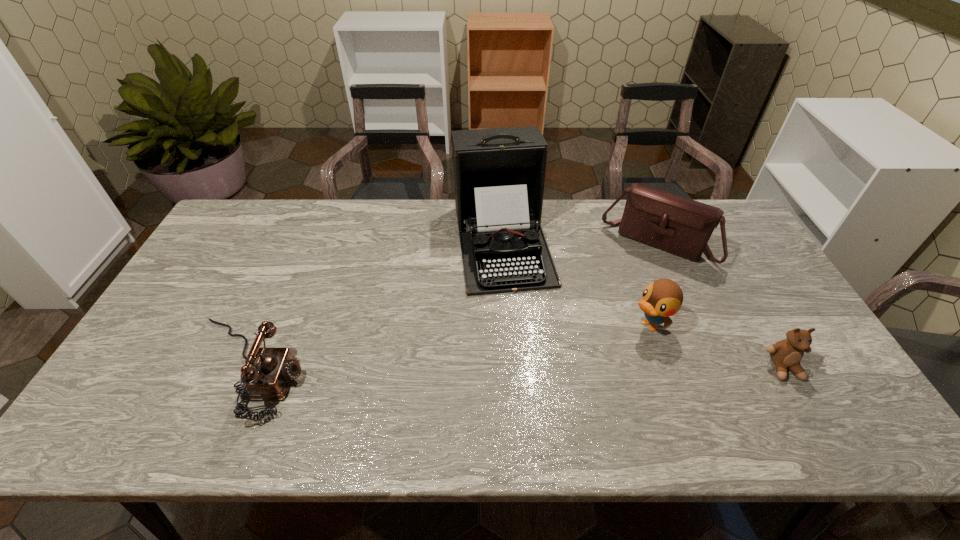
Find the location of a particular element. telephone is located at coordinates (268, 378).

Locate an element on the screen. This screenshot has width=960, height=540. teddy bear is located at coordinates (786, 354).

The width and height of the screenshot is (960, 540). What are the coordinates of `shoulder bag` in the screenshot? It's located at (672, 223).

Identify the location of the fourth object from right to left. The width and height of the screenshot is (960, 540). pos(499,174).

The image size is (960, 540). I want to click on the tallest object, so click(499, 174).

Locate an element on the screen. duck is located at coordinates (663, 298).

Identify the location of vacant region located 0.270m on the dial of the leftmost object. Image resolution: width=960 pixels, height=540 pixels. (415, 368).

This screenshot has width=960, height=540. I want to click on free region located on the front flap of the shoulder bag, so click(x=600, y=337).

What are the coordinates of `vacant space situated on the front flap of the shoulder bag` in the screenshot? It's located at (627, 287).

Identify the location of vacant space located 0.090m on the front flap of the shoulder bag. This screenshot has height=540, width=960. (628, 285).